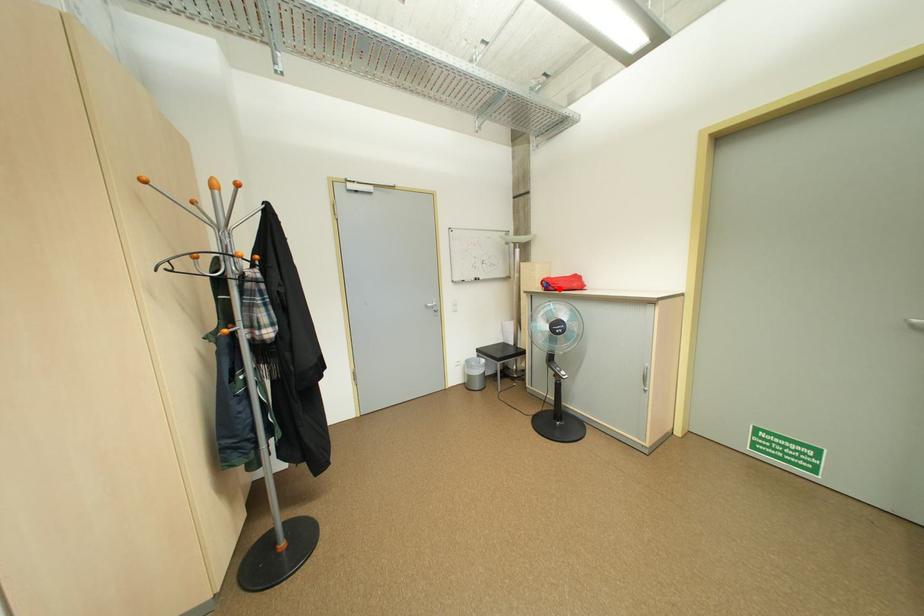
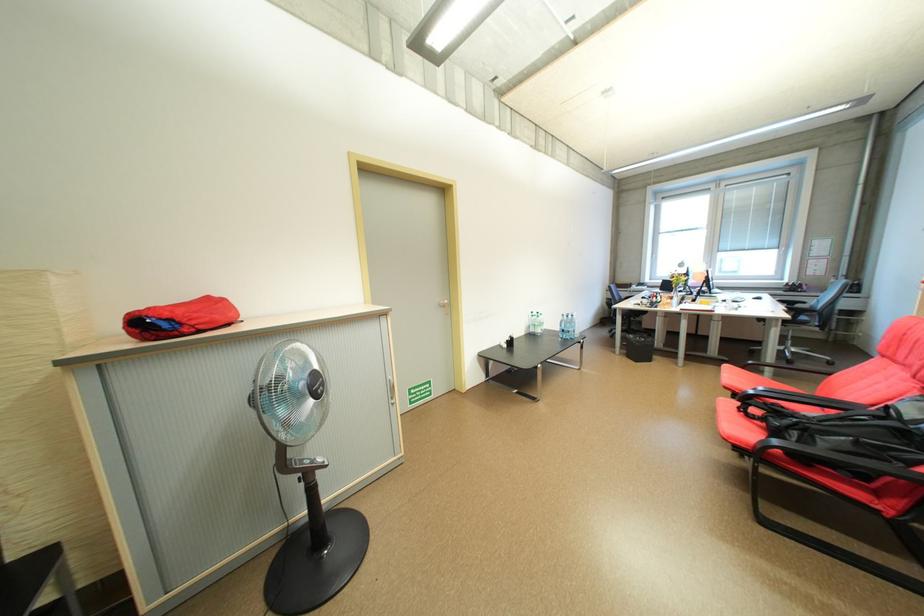
In the second image, find the point that corresponds to the highlighted location in the first image.

(196, 331)